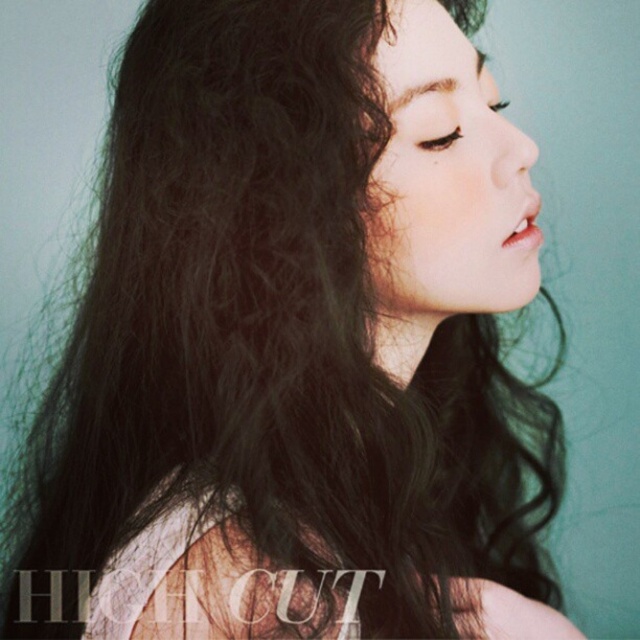
Question: Which of the following is the farthest from the observer?

Choices:
 (A) (444, 147)
 (B) (486, 104)

Answer: (B)

Question: Is matte black eye at upper center smaller than black matte eye at upper center?

Choices:
 (A) yes
 (B) no

Answer: (A)

Question: Is matte black eye at upper center bigger than black matte eye at upper center?

Choices:
 (A) no
 (B) yes

Answer: (A)

Question: Is matte black eye at upper center closer to the viewer compared to black matte eye at upper center?

Choices:
 (A) yes
 (B) no

Answer: (A)

Question: Which point is farther from the camera taking this photo?

Choices:
 (A) (492, 108)
 (B) (456, 125)

Answer: (A)